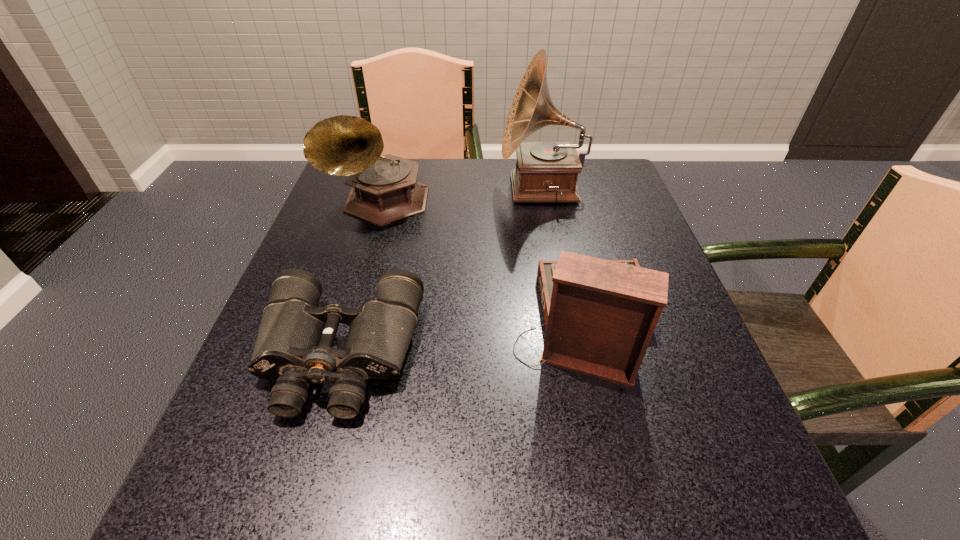
In the image, there is a desktop. Identify the location of vacant space at the near left corner. (206, 514).

At what (x,y) coordinates should I click in order to perform the action: click on vacant area at the far right corner. Please return your answer as a coordinate pair (x, y). This screenshot has width=960, height=540. Looking at the image, I should click on (588, 159).

Image resolution: width=960 pixels, height=540 pixels. Identify the location of free location at the near right corner. (659, 493).

At what (x,y) coordinates should I click in order to perform the action: click on empty location between the nearest phonograph record and the binoculars. Please return your answer as a coordinate pair (x, y). Looking at the image, I should click on (461, 339).

Find the location of `free spot between the binoculars and the tallest object`. free spot between the binoculars and the tallest object is located at coordinates pos(441,271).

Where is `free space between the shortest phonograph record and the binoculars`? The width and height of the screenshot is (960, 540). free space between the shortest phonograph record and the binoculars is located at coordinates (461, 339).

Find the location of a particular element. The image size is (960, 540). vacant area that lies between the second shortest object and the second tallest phonograph record is located at coordinates (481, 263).

What are the coordinates of `vacant point located between the second tallest object and the shortest phonograph record` in the screenshot? It's located at (481, 263).

Identify the location of vacant space that is in between the second shortest phonograph record and the shortest object. This screenshot has width=960, height=540. (360, 278).

You are a GUI agent. You are given a task and a screenshot of the screen. Output one action in this format:
    pyautogui.click(x=<x>, y=<y>)
    Task: Click on the vacant area that lies between the shortest object and the second shortest phonograph record
    
    Given the screenshot: What is the action you would take?
    pyautogui.click(x=360, y=278)